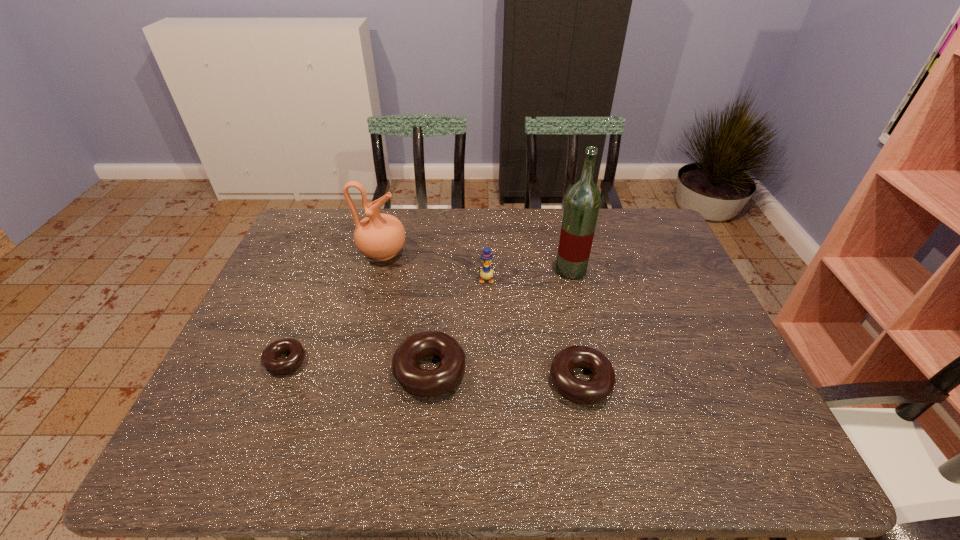
Where is `vacant region located on the back of the shortest doughnut`? The image size is (960, 540). vacant region located on the back of the shortest doughnut is located at coordinates (298, 330).

You are a GUI agent. You are given a task and a screenshot of the screen. Output one action in this format:
    pyautogui.click(x=<x>, y=<y>)
    Task: Click on the free location located on the right of the fourth object from right to left
    
    Given the screenshot: What is the action you would take?
    pyautogui.click(x=487, y=371)

Locate an element on the screen. Image resolution: width=960 pixels, height=540 pixels. vacant space situated 0.140m on the right of the second tallest doughnut is located at coordinates (672, 382).

I want to click on vacant region located 0.170m on the spout of the second object from left to right, so click(x=461, y=253).

Image resolution: width=960 pixels, height=540 pixels. Find the location of `free space located on the back of the liquor`. free space located on the back of the liquor is located at coordinates (557, 208).

Where is `free space located 0.350m on the face of the third tallest object, where the monocle is placed`? The image size is (960, 540). free space located 0.350m on the face of the third tallest object, where the monocle is placed is located at coordinates (487, 387).

The image size is (960, 540). Identify the location of object present at the far edge. coord(379,236).

I want to click on object that is at the left edge, so click(x=269, y=360).

Identify the location of vacant space at the far edge of the desktop. (501, 245).

At what (x,y) coordinates should I click in order to perform the action: click on vacant region at the near edge of the desktop. Please return your answer as a coordinate pair (x, y). This screenshot has width=960, height=540. Looking at the image, I should click on (602, 408).